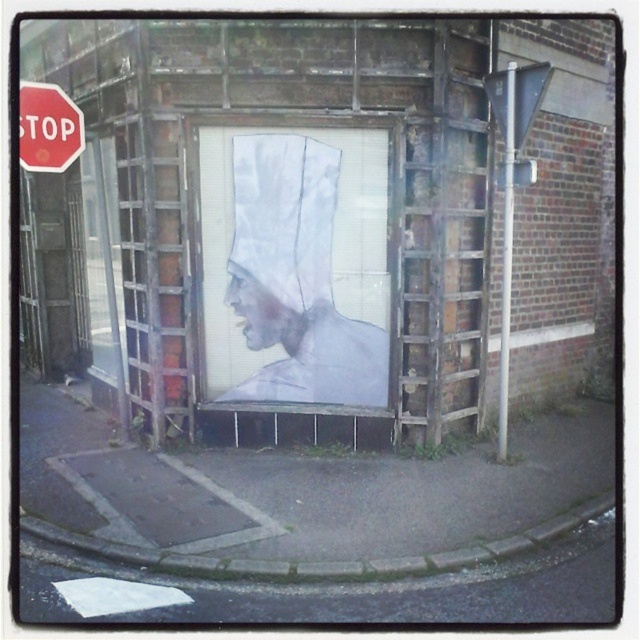
Question: Does white paper bag at center have a larger size compared to red plastic stop sign at upper left?

Choices:
 (A) yes
 (B) no

Answer: (A)

Question: Which of the following is the farthest from the observer?

Choices:
 (A) (333, 330)
 (B) (64, 140)

Answer: (A)

Question: Where is white paper bag at center located in relation to red plastic stop sign at upper left in the image?

Choices:
 (A) above
 (B) below

Answer: (B)

Question: Which point appears farthest from the camera in this image?

Choices:
 (A) (40, 120)
 (B) (330, 221)

Answer: (B)

Question: Among these points, which one is nearest to the camera?

Choices:
 (A) (323, 237)
 (B) (19, 99)

Answer: (B)

Question: Does white paper bag at center have a smaller size compared to red plastic stop sign at upper left?

Choices:
 (A) yes
 (B) no

Answer: (B)